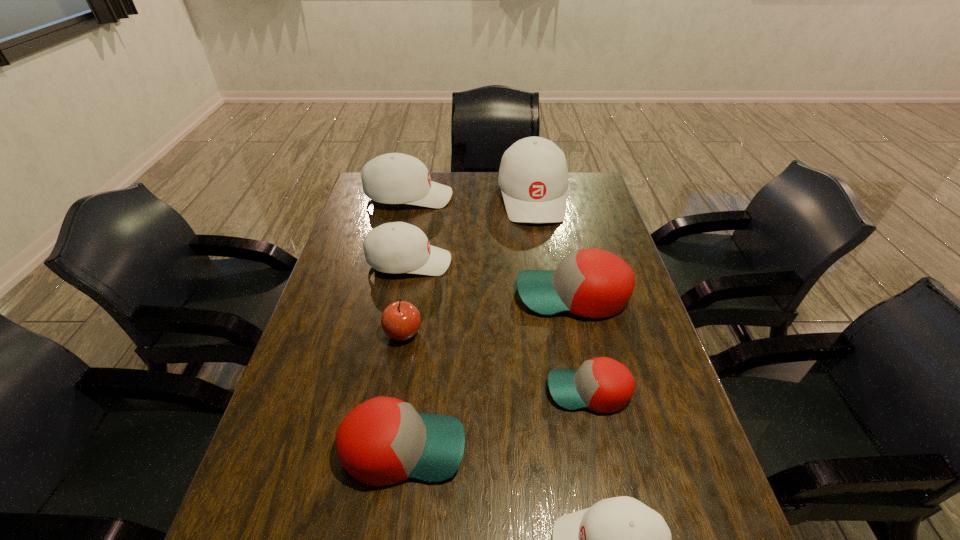
Identify the location of free space between the second biggest white baseball cap and the shortest baseball cap. Image resolution: width=960 pixels, height=540 pixels. (499, 294).

Choose which object is the third nearest neighbor to the leftmost red baseball cap. Please provide its 2D coordinates. Your answer should be formatted as a tuple, i.e. [(x, y)], where the tuple contains the x and y coordinates of a point satisfying the conditions above.

[(602, 384)]

I want to click on object that is the sixth closest to the smallest red baseball cap, so click(533, 176).

Choose which baseball cap is the second nearest neighbor to the second smallest red baseball cap. Please provide its 2D coordinates. Your answer should be formatted as a tuple, i.e. [(x, y)], where the tuple contains the x and y coordinates of a point satisfying the conditions above.

[(602, 384)]

Locate an element on the screen. Image resolution: width=960 pixels, height=540 pixels. baseball cap that is the sixth closest to the nearest object is located at coordinates (394, 178).

The image size is (960, 540). What are the coordinates of `white baseball cap that is the second closest to the second nearest white baseball cap` in the screenshot? It's located at (394, 178).

Where is `the third closest white baseball cap to the nearest white baseball cap`? The width and height of the screenshot is (960, 540). the third closest white baseball cap to the nearest white baseball cap is located at coordinates (394, 178).

Point out which red baseball cap is positioned as the second nearest to the nearest white baseball cap. Please provide its 2D coordinates. Your answer should be formatted as a tuple, i.e. [(x, y)], where the tuple contains the x and y coordinates of a point satisfying the conditions above.

[(602, 384)]

Identify which red baseball cap is the second nearest to the second smallest red baseball cap. Please provide its 2D coordinates. Your answer should be formatted as a tuple, i.e. [(x, y)], where the tuple contains the x and y coordinates of a point satisfying the conditions above.

[(594, 283)]

Find the location of a particular element. The image size is (960, 540). free location that satisfies the following two spatial constraints: 1. on the front-facing side of the tallest baseball cap; 2. at the brim of the leftmost red baseball cap is located at coordinates (574, 448).